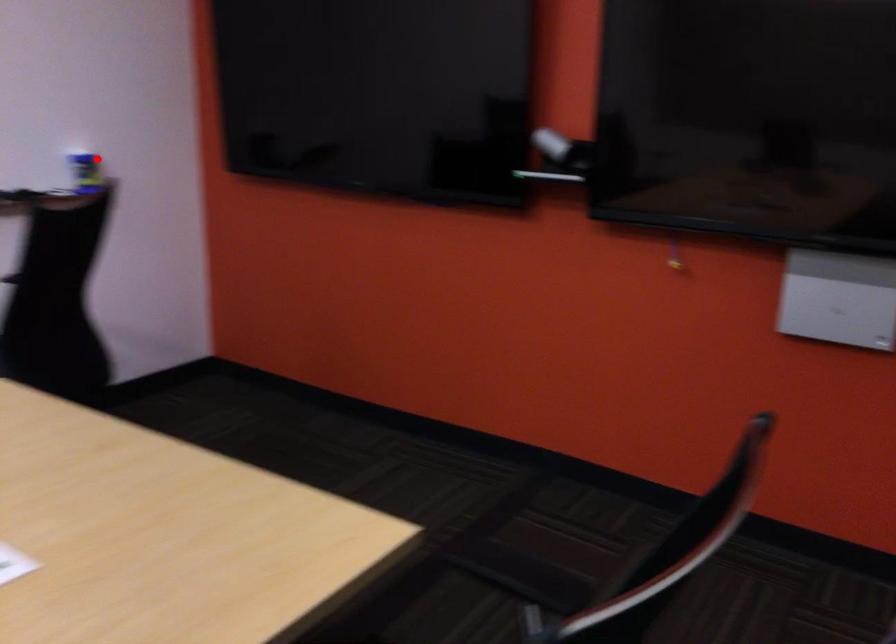
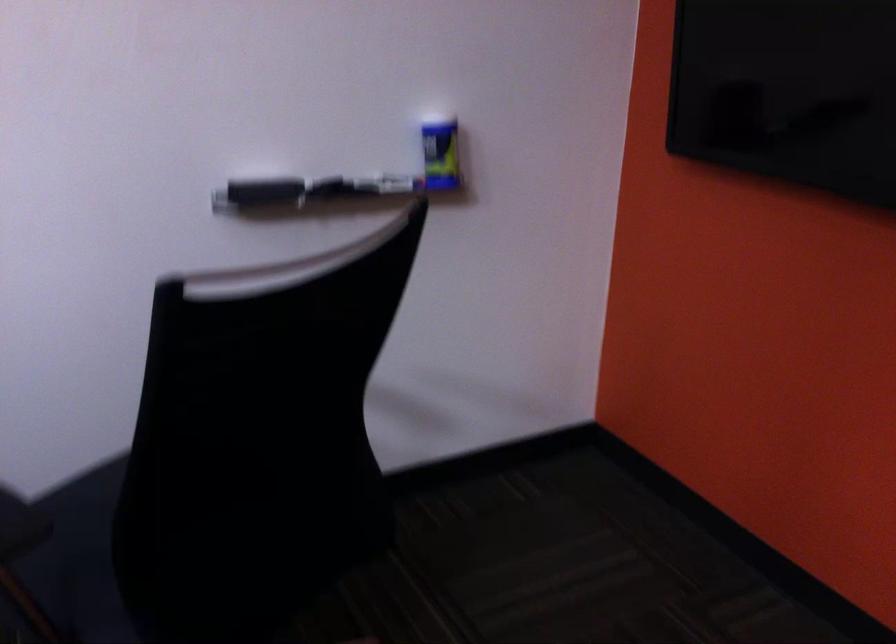
Locate, in the second image, the point that corresponds to the highlighted location in the first image.

(440, 156)